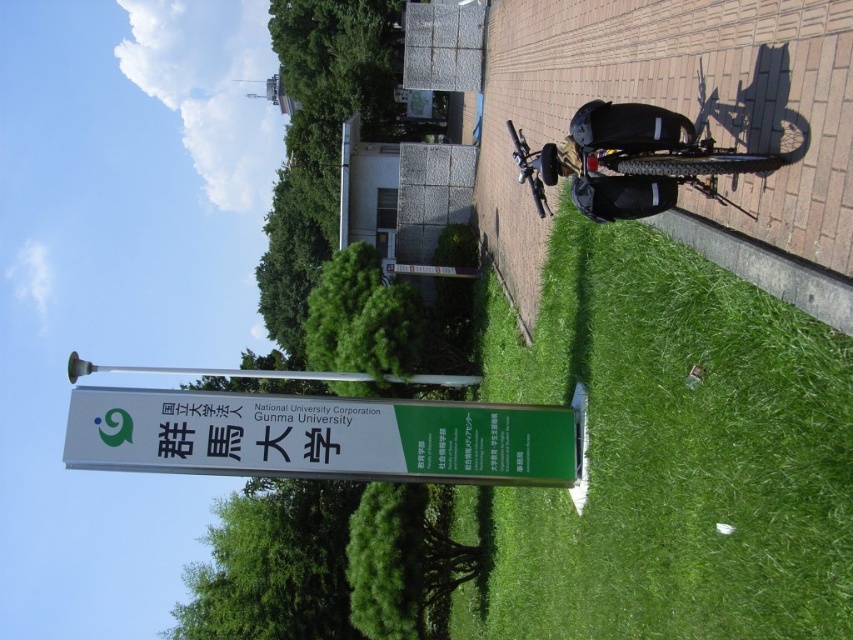
You are a visitor at Gumma University and want to locate the signboard. The signboard has a green logo and text in both Japanese and English. You see a green plastic sign at center and a silver metallic pole at upper center. Which object is positioned to the right of the other?

The green plastic sign at center is to the right of the silver metallic pole at upper center.

In the scene shown: You are standing in front of the Gumma University signboard and want to walk towards the green grass at lower center. Which direction should you move relative to the silver metallic pole at upper center?

The green grass at lower center is positioned on the right side of the silver metallic pole at upper center. To reach the green grass at lower center, you should move towards the right side of the silver metallic pole at upper center.

You are standing at the signboard at Gumma University and want to walk to a point that is closer to the camera. Which point should you head towards, point (534, 470) or point (305, 372)?

You should head towards point (534, 470) because it is closer to the camera than point (305, 372).